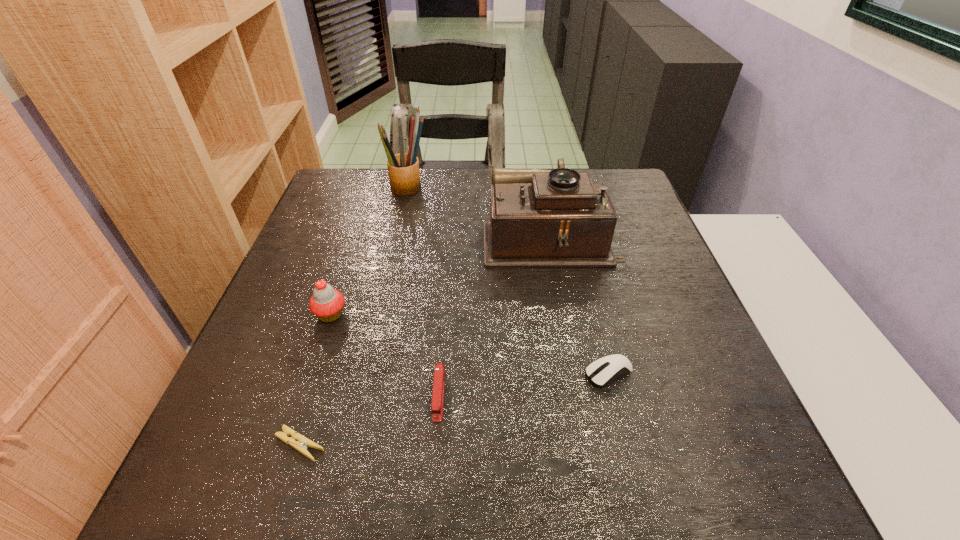
Locate an element on the screen. The width and height of the screenshot is (960, 540). cupcake that is at the left edge is located at coordinates (326, 303).

Image resolution: width=960 pixels, height=540 pixels. What are the coordinates of `clothespin present at the left edge` in the screenshot? It's located at (301, 446).

In order to click on object situated at the right edge in this screenshot , I will do `click(558, 218)`.

Locate an element on the screen. The width and height of the screenshot is (960, 540). object that is at the near left corner is located at coordinates (301, 446).

At what (x,y) coordinates should I click in order to perform the action: click on object present at the far right corner. Please return your answer as a coordinate pair (x, y). The height and width of the screenshot is (540, 960). Looking at the image, I should click on (558, 218).

The image size is (960, 540). In the image, there is a desktop. Identify the location of free space at the far edge. (475, 168).

Where is `free space at the near edge of the desktop`? This screenshot has width=960, height=540. free space at the near edge of the desktop is located at coordinates (584, 460).

Image resolution: width=960 pixels, height=540 pixels. I want to click on free region at the left edge, so click(296, 408).

Find the location of a particular element. This screenshot has width=960, height=540. vacant space at the right edge is located at coordinates (626, 302).

Where is `free point at the far left corner`? free point at the far left corner is located at coordinates (349, 204).